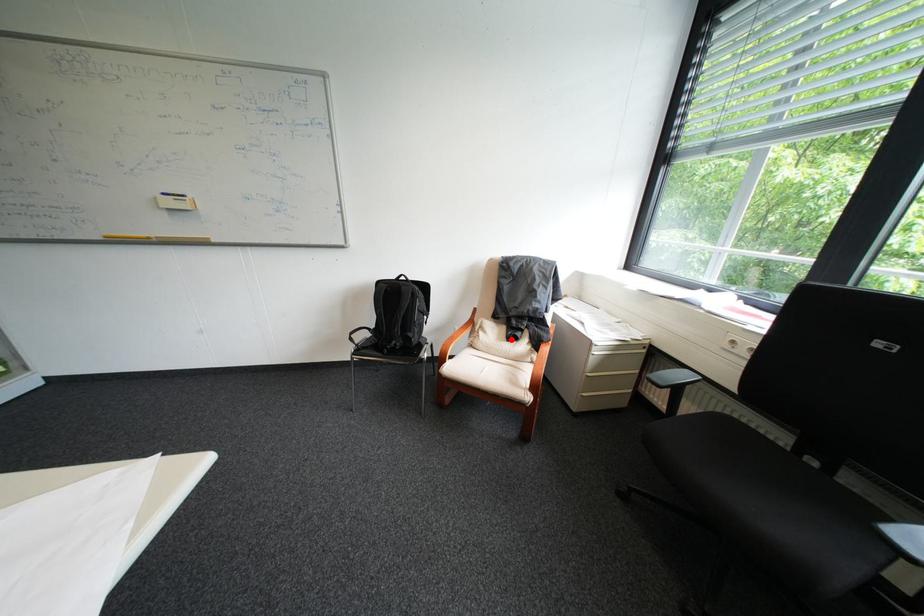
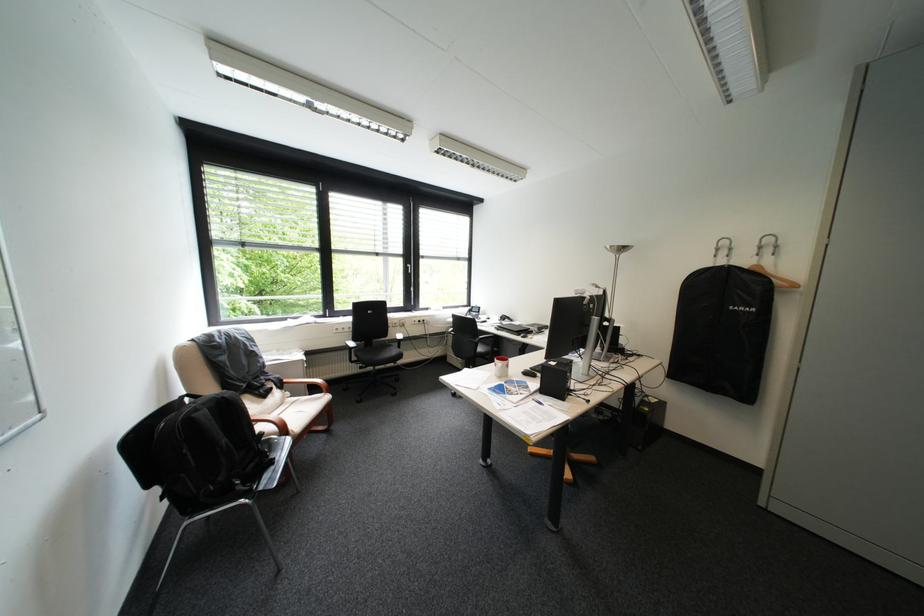
In the second image, find the point that corresponds to the highlighted location in the first image.

(272, 403)